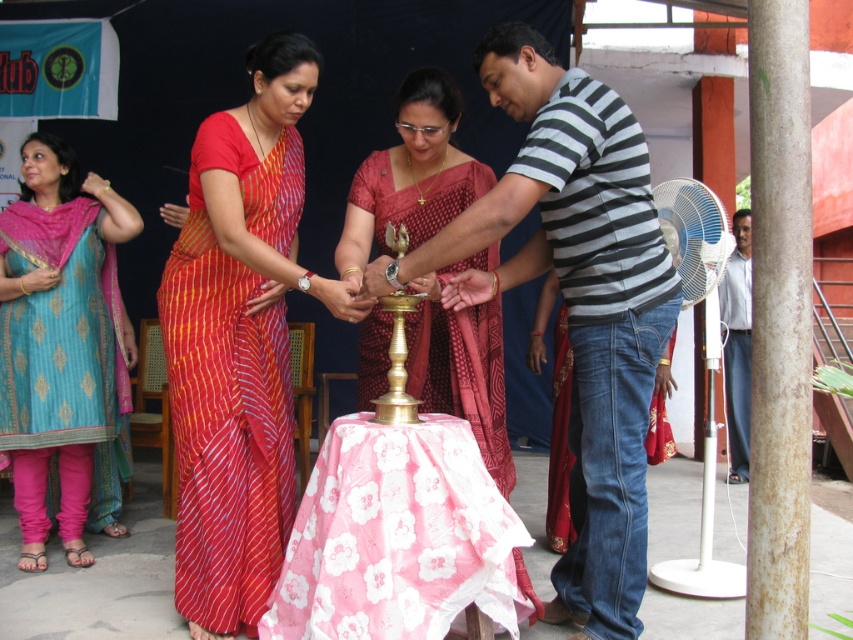
Question: Is striped cotton shirt at center thinner than white shirt at right?

Choices:
 (A) no
 (B) yes

Answer: (A)

Question: Which point is farther to the camera?

Choices:
 (A) red striped saree at center
 (B) teal silk kurta with pink pants at left

Answer: (B)

Question: Does striped cotton shirt at center have a smaller size compared to red striped saree at center?

Choices:
 (A) yes
 (B) no

Answer: (B)

Question: Which point is closer to the camera?

Choices:
 (A) (447, 385)
 (B) (286, 580)
 (C) (262, 348)

Answer: (B)

Question: Which point is farther to the camera?

Choices:
 (A) (744, 408)
 (B) (425, 561)

Answer: (A)

Question: Is striped cotton shirt at center above pink floral fabric at center?

Choices:
 (A) yes
 (B) no

Answer: (A)